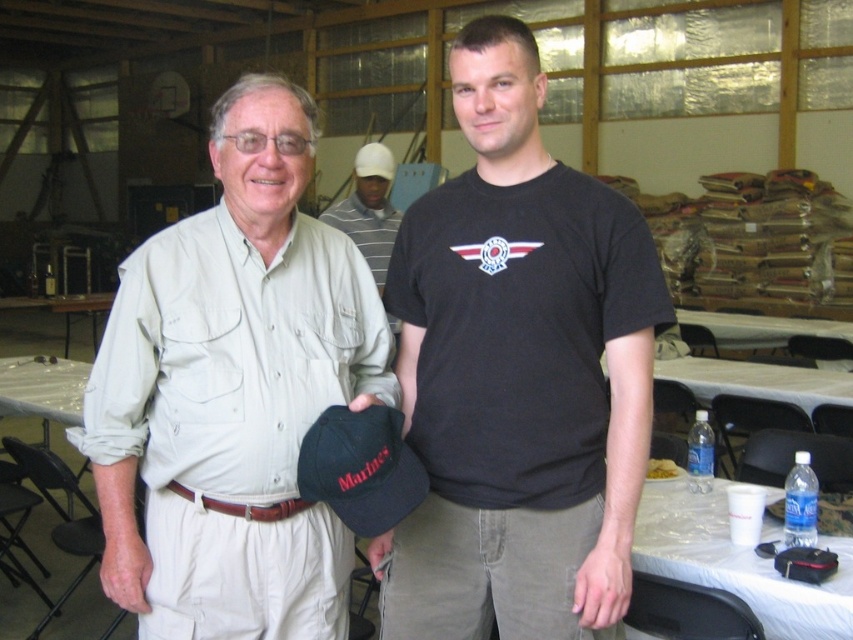
You are a tailor observing a man wearing a khaki cotton shirt at center and a brown leather belt at center. Which clothing item is more to the left?

The brown leather belt at center is more to the left because the khaki cotton shirt at center is positioned on the right side of it.

You are standing in the warehouse and see two points marked in the image. Which point is closer to you, point (427, 285) or point (177, 492)?

Point (177, 492) is closer to you because the description states that point (427, 285) is further to the camera than point (177, 492).